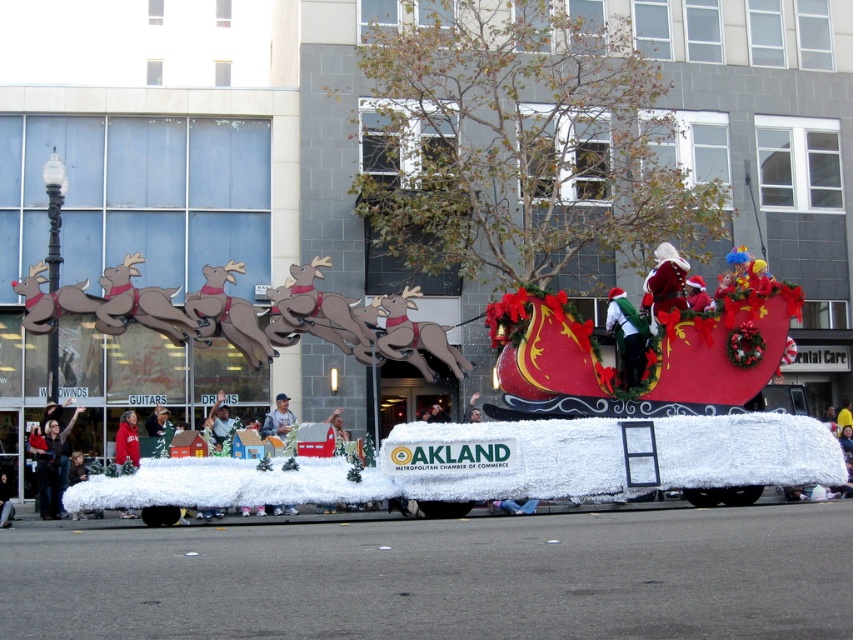
You are a photographer standing at the parade float and want to capture both the dark gray sweater at lower left and the velvet santa hat at center in a single photo. Which object should you focus on first to ensure both are in frame?

You should focus on the velvet santa hat at center first because the dark gray sweater at lower left is below it, so adjusting the camera angle to include the lower area will capture both.

You are a photographer standing at the dark gray sweater at lower left position. You want to take a photo of the velvet santa hat at center without moving. Can you capture the entire scene between them in one shot?

The distance between dark gray sweater at lower left and velvet santa hat at center is 9.02 meters. Since you are at the dark gray sweater at lower left position and the velvet santa hat at center is 9.02 meters away, you can capture the entire scene in one shot as most professional cameras can capture such distances without needing to move.

You are a photographer trying to capture both the dark gray sweater at lower left and the velvet santa hat at center in a single frame. Which object should you focus on first to ensure both fit in the frame, considering their sizes?

The dark gray sweater at lower left is wider than the velvet santa hat at center, so focusing on the dark gray sweater at lower left first will help ensure both fit in the frame.